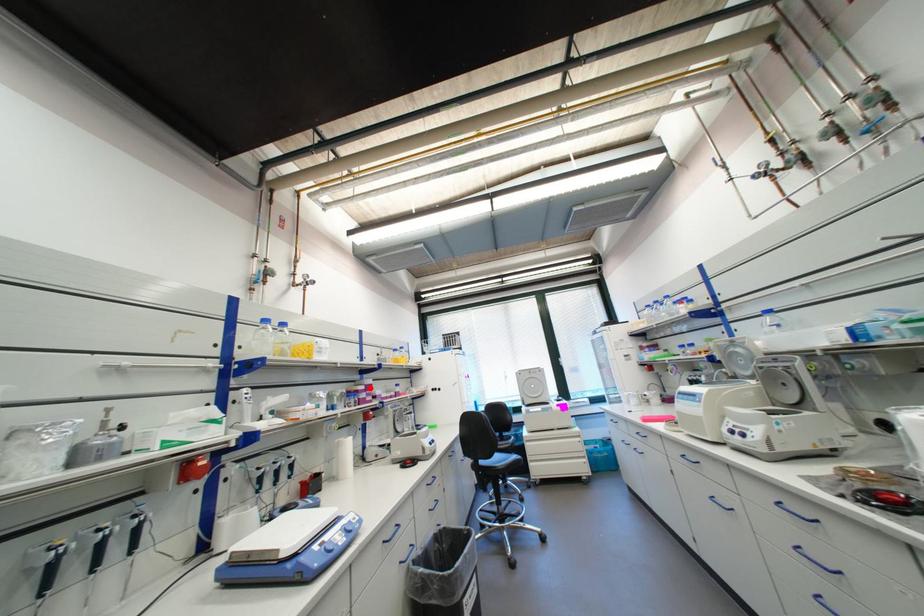
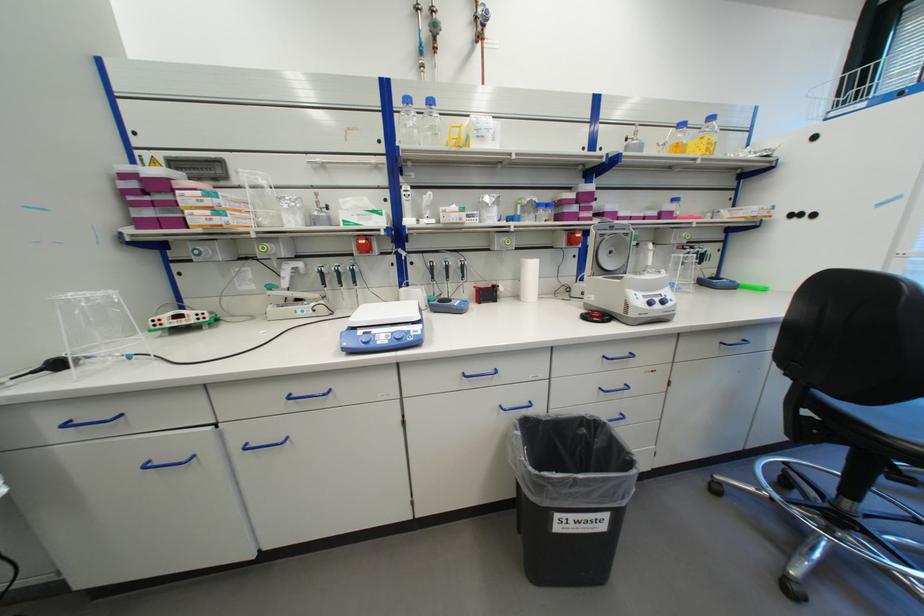
Question: I am providing you with two images of the same scene from different viewpoints. In image1, a red point is highlighted. Considering the same 3D point in image2, which of the following is correct?

Choices:
 (A) It is closer
 (B) It is farther

Answer: (A)